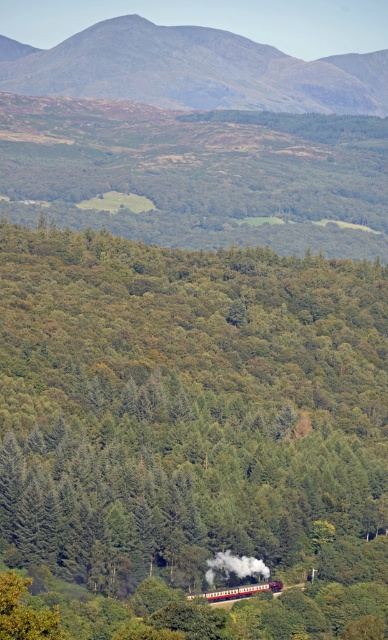
Which is more to the right, rugged brown mountain at upper center or red polished wood passenger train at center?

red polished wood passenger train at center is more to the right.

Looking at this image, which is above, rugged brown mountain at upper center or red polished wood passenger train at center?

rugged brown mountain at upper center

Who is more forward, (219, 81) or (259, 589)?

Point (259, 589) is more forward.

The width and height of the screenshot is (388, 640). In order to click on rugged brown mountain at upper center in this screenshot , I will do `click(192, 70)`.

Which is more to the right, polished brass steam at lower center or red polished wood passenger train at center?

red polished wood passenger train at center

From the picture: Who is positioned more to the left, polished brass steam at lower center or red polished wood passenger train at center?

polished brass steam at lower center is more to the left.

At what (x,y) coordinates should I click in order to perform the action: click on polished brass steam at lower center. Please return your answer as a coordinate pair (x, y). This screenshot has height=640, width=388. Looking at the image, I should click on point(235,564).

Is rugged brown mountain at upper center above polished brass steam at lower center?

Yes, rugged brown mountain at upper center is above polished brass steam at lower center.

In the scene shown: Can you confirm if rugged brown mountain at upper center is thinner than polished brass steam at lower center?

In fact, rugged brown mountain at upper center might be wider than polished brass steam at lower center.

Between point (157, 51) and point (225, 550), which one is positioned in front?

Point (225, 550) is more forward.

I want to click on rugged brown mountain at upper center, so click(192, 70).